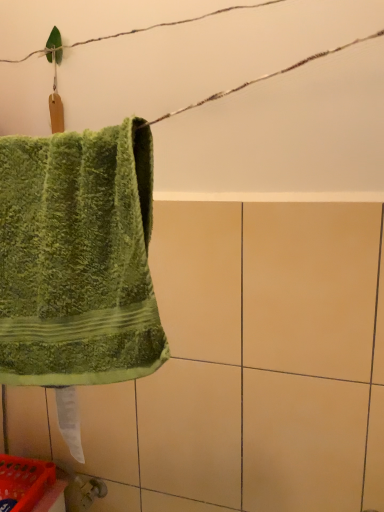
Question: Is green fuzzy towel at left taller than orange plastic basket at lower left?

Choices:
 (A) no
 (B) yes

Answer: (B)

Question: Is green fuzzy towel at left wider than orange plastic basket at lower left?

Choices:
 (A) yes
 (B) no

Answer: (B)

Question: Is green fuzzy towel at left outside of orange plastic basket at lower left?

Choices:
 (A) yes
 (B) no

Answer: (A)

Question: From a real-world perspective, is green fuzzy towel at left physically above orange plastic basket at lower left?

Choices:
 (A) yes
 (B) no

Answer: (A)

Question: From the image's perspective, is green fuzzy towel at left beneath orange plastic basket at lower left?

Choices:
 (A) no
 (B) yes

Answer: (A)

Question: From a real-world perspective, is green fuzzy towel at left below orange plastic basket at lower left?

Choices:
 (A) no
 (B) yes

Answer: (A)

Question: Are orange plastic basket at lower left and green fuzzy towel at left making contact?

Choices:
 (A) no
 (B) yes

Answer: (A)

Question: Does orange plastic basket at lower left appear on the right side of green fuzzy towel at left?

Choices:
 (A) no
 (B) yes

Answer: (A)

Question: Is orange plastic basket at lower left oriented away from green fuzzy towel at left?

Choices:
 (A) no
 (B) yes

Answer: (A)

Question: From the image's perspective, is orange plastic basket at lower left beneath green fuzzy towel at left?

Choices:
 (A) no
 (B) yes

Answer: (B)

Question: Does orange plastic basket at lower left come behind green fuzzy towel at left?

Choices:
 (A) no
 (B) yes

Answer: (B)

Question: From a real-world perspective, is orange plastic basket at lower left under green fuzzy towel at left?

Choices:
 (A) no
 (B) yes

Answer: (B)

Question: Would you say green fuzzy towel at left is inside or outside orange plastic basket at lower left?

Choices:
 (A) inside
 (B) outside

Answer: (B)